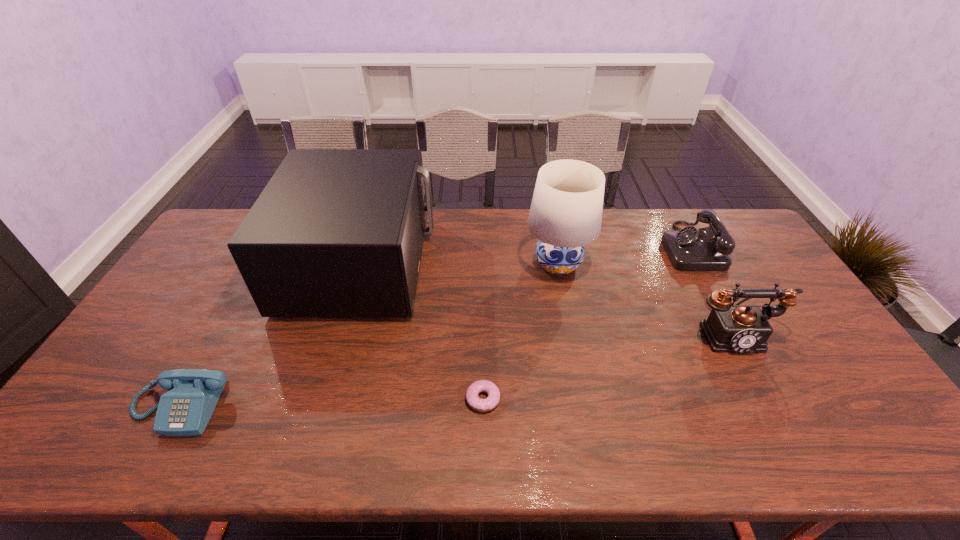
Locate an element on the screen. The height and width of the screenshot is (540, 960). object at the near edge is located at coordinates click(185, 410).

Where is `object that is positioned at the left edge`? This screenshot has height=540, width=960. object that is positioned at the left edge is located at coordinates (185, 410).

Locate an element on the screen. The height and width of the screenshot is (540, 960). object present at the near left corner is located at coordinates tap(185, 410).

At what (x,y) coordinates should I click in order to perform the action: click on object that is at the far right corner. Please return your answer as a coordinate pair (x, y). Image resolution: width=960 pixels, height=540 pixels. Looking at the image, I should click on (690, 249).

In the image, there is a desktop. Where is `blank space at the far edge`? Image resolution: width=960 pixels, height=540 pixels. blank space at the far edge is located at coordinates (489, 215).

The height and width of the screenshot is (540, 960). In order to click on vacant space at the near edge of the desktop in this screenshot , I will do `click(400, 454)`.

The image size is (960, 540). Find the location of `free point at the left edge`. free point at the left edge is located at coordinates (210, 258).

In the image, there is a desktop. Where is `blank space at the far left corner`? blank space at the far left corner is located at coordinates (213, 233).

Where is `free spot between the tallest telephone and the fifth shortest object`? free spot between the tallest telephone and the fifth shortest object is located at coordinates click(x=547, y=299).

Find the location of a particular element. Image resolution: width=960 pixels, height=540 pixels. vacant point located between the third shortest object and the tallest telephone is located at coordinates 711,290.